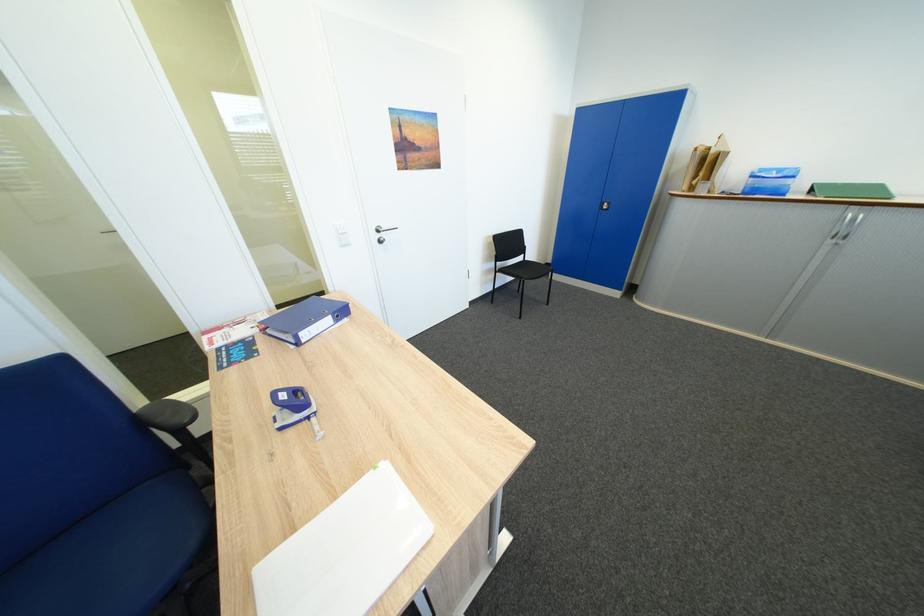
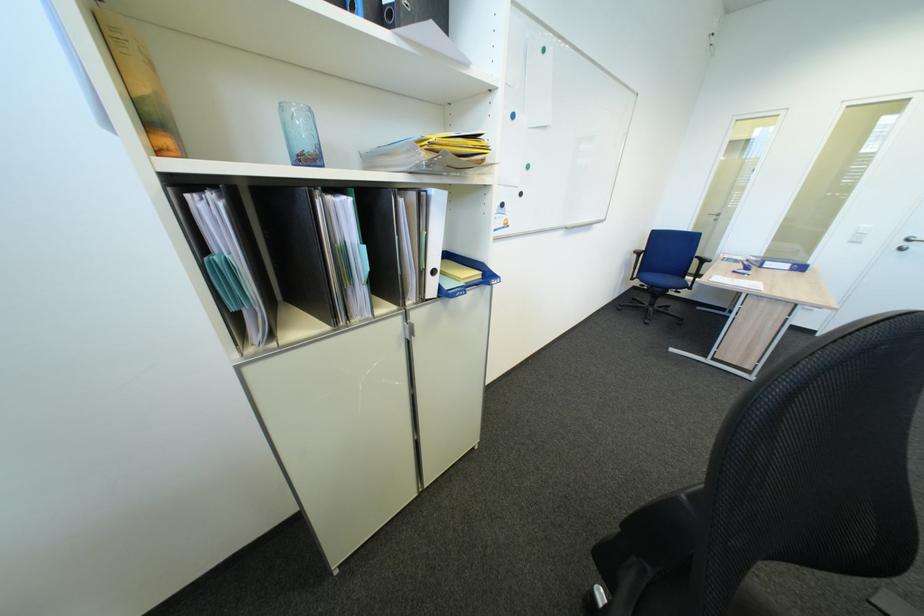
In the second image, find the point that corresponds to (310,334) in the first image.

(776, 264)